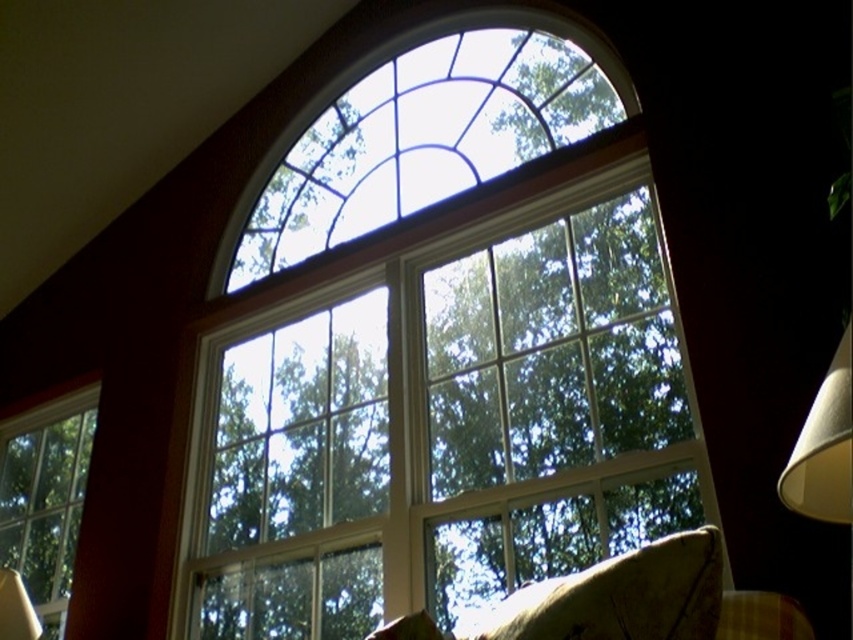
Consider the image. You are arranging a small table in the room and want to place both the patterned fabric pillow at lower right and the clear glass window at lower left on it. Which object should you place closer to the center of the table?

The clear glass window at lower left should be placed closer to the center of the table because the patterned fabric pillow at lower right is positioned on the right side of it.

You are standing in the room with the arched window and want to place a small plant at one of two points marked on the floor. The points are labeled as point 1 at coordinates point (x=653, y=294) and point 2 at coordinates point (x=77, y=508). Which point is closer to you as you face the window?

Point (x=653, y=294) is closer to the viewer than point (x=77, y=508), so you should place the plant at point (x=653, y=294) if you want it closer to your current position facing the window.

You are trying to hang a new picture frame on the wall. The frame is heavy and you need to avoid placing it over any existing objects. Based on the scene, can you hang the picture frame over the white paper lampshade at right without covering the clear glass window at center?

The clear glass window at center is positioned over the white paper lampshade at right, so hanging the picture frame over the white paper lampshade at right would place it below the window. Therefore, it won